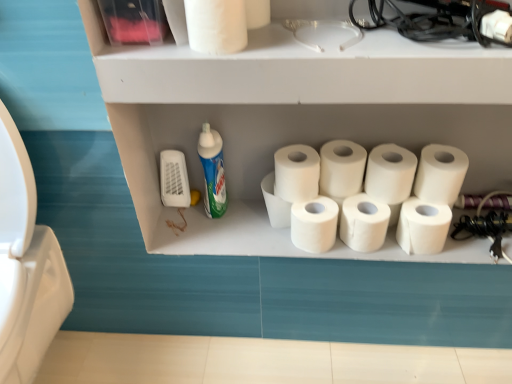
Where is `free location to the left of blue glossy bottle at center-left`? This screenshot has width=512, height=384. free location to the left of blue glossy bottle at center-left is located at coordinates (172, 220).